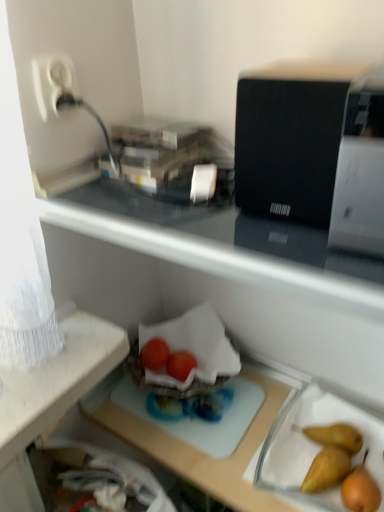
Question: From the image's perspective, is white glossy printer at upper right, which appears as the first appliance when viewed from the right, located above or below glossy plastic tomatoes at center, the first green vegetables when ordered from left to right?

Choices:
 (A) below
 (B) above

Answer: (B)

Question: Do you think white glossy printer at upper right, arranged as the second appliance when viewed from the left, is within glossy plastic tomatoes at center, the second green vegetables viewed from the right, or outside of it?

Choices:
 (A) inside
 (B) outside

Answer: (B)

Question: Which is farther from the black matte speaker at upper right, the first appliance positioned from the left?

Choices:
 (A) white glossy printer at upper right, arranged as the second appliance when viewed from the left
 (B) white plastic plug at upper left
 (C) smooth brown pear at lower right
 (D) transparent plastic tray at center
 (E) glossy plastic tomatoes at center, the second green vegetables viewed from the right

Answer: (E)

Question: Which object is positioned farthest from the smooth brown pear at lower right?

Choices:
 (A) white plastic plug at upper left
 (B) black matte speaker at upper right, acting as the second appliance starting from the right
 (C) transparent plastic tray at center
 (D) glossy plastic tomatoes at center, the second green vegetables viewed from the right
 (E) glossy plastic tomatoes at center, positioned as the 2th green vegetables in left-to-right order

Answer: (A)